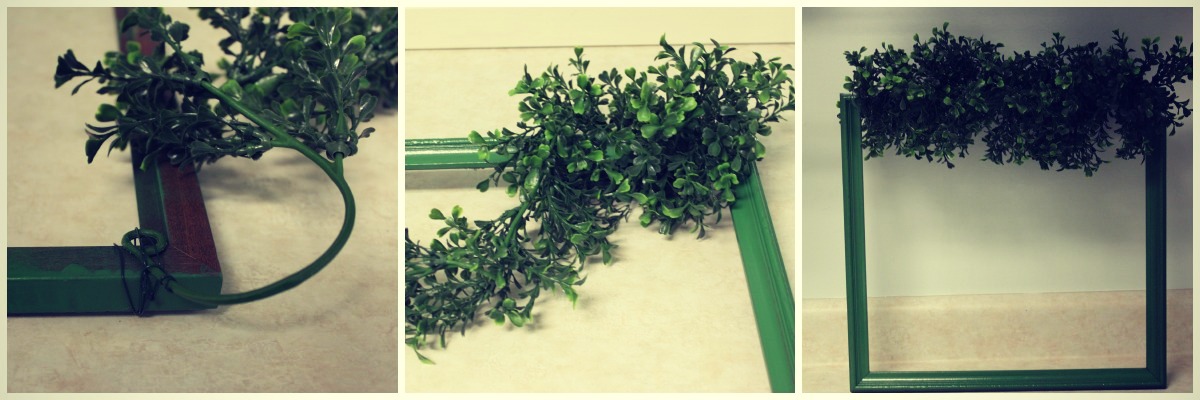
Where is `3 green frames`? 3 green frames is located at coordinates (85, 270), (752, 254), (883, 296).